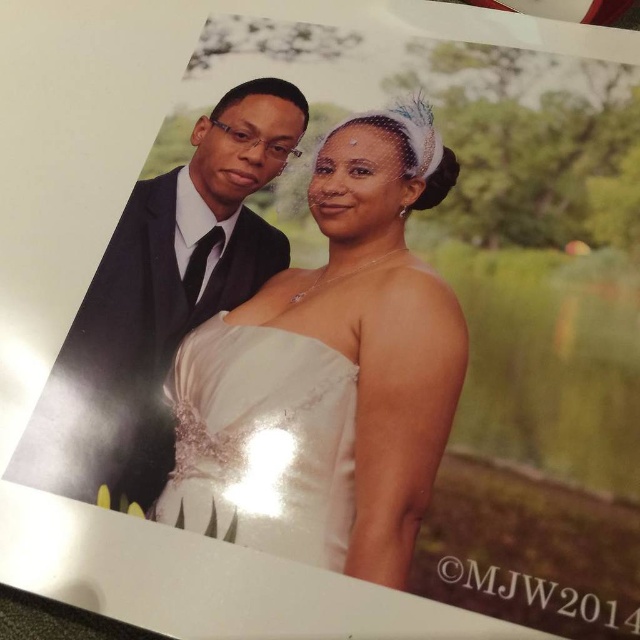
Is white satin dress at center above matte black suit at left?

Incorrect, white satin dress at center is not positioned above matte black suit at left.

Can you confirm if white satin dress at center is bigger than matte black suit at left?

Yes, white satin dress at center is bigger than matte black suit at left.

Is point (321, 296) in front of point (275, 161)?

That is True.

I want to click on white satin dress at center, so click(330, 371).